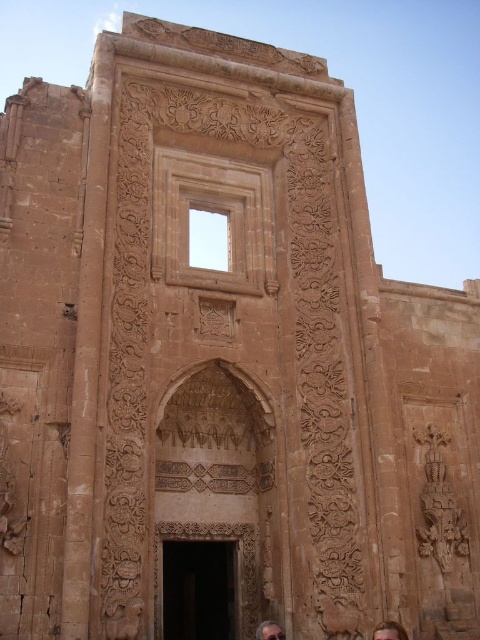
Can you confirm if brown hair at lower center is positioned to the right of gray hair at lower center?

Indeed, brown hair at lower center is positioned on the right side of gray hair at lower center.

Does brown hair at lower center lie behind gray hair at lower center?

That is False.

Does point (374, 632) lie in front of point (278, 637)?

No, (374, 632) is further to viewer.

Image resolution: width=480 pixels, height=640 pixels. I want to click on brown hair at lower center, so click(x=389, y=630).